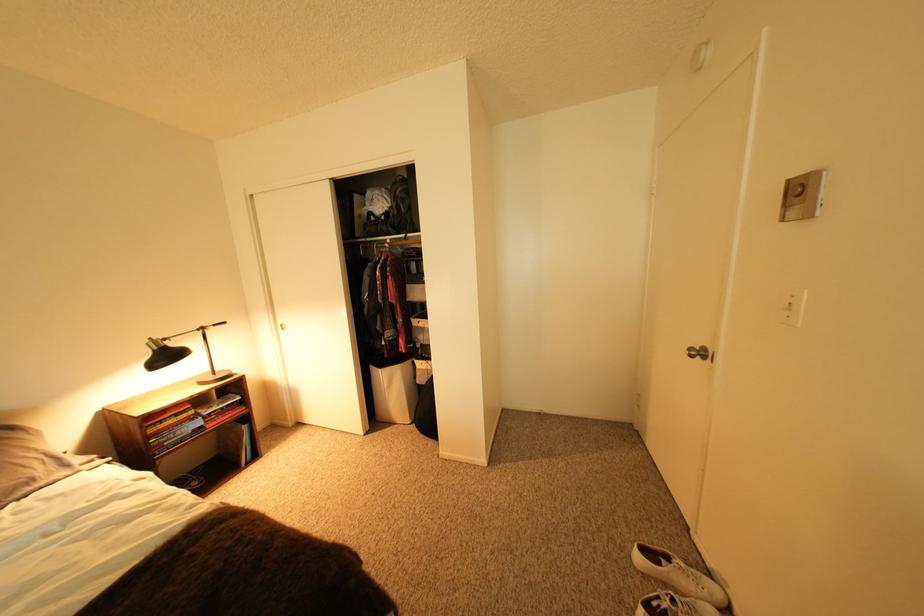
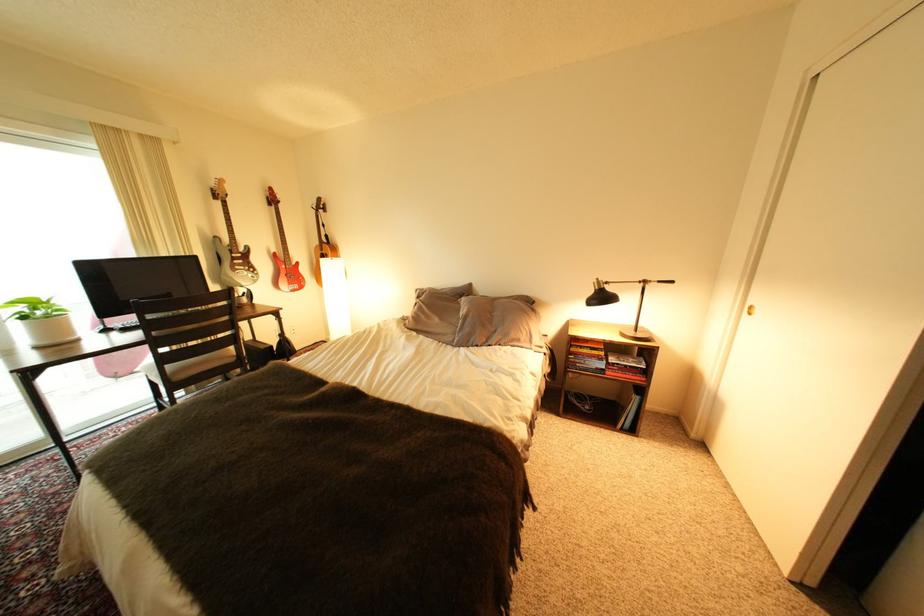
In the second image, find the point that corresponds to pixel 217 416 in the first image.

(623, 363)